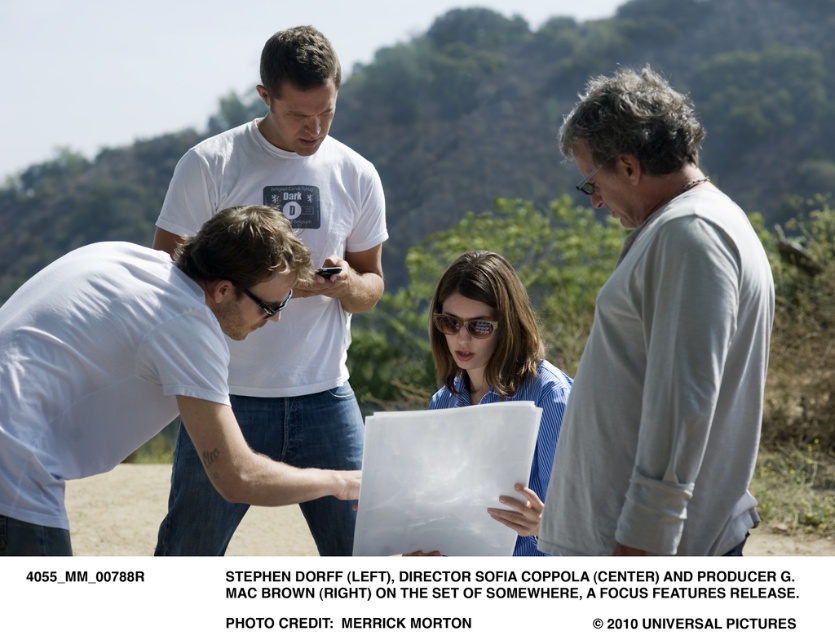
You are a photographer trying to capture a clear shot of the brown reflective sunglasses at center and the matte black goggles at center. Since both are at the center, which one is more to the right?

The brown reflective sunglasses at center is positioned on the right side of matte black goggles at center, so it is more to the right.

You are a photographer trying to capture a closeup of the brown reflective sunglasses at center and the matte black goggles at center. Given that your camera lens can only accommodate objects up to 10 cm in width, can you determine which of these items might not fit within the frame?

The brown reflective sunglasses at center has a greater width than the matte black goggles at center. Since the camera lens can only accommodate up to 10 cm, if the sunglasses exceed this width, they might not fit, but the goggles, being narrower, would likely fit. However, without exact measurements, it depends on the sunglasses actual size.

You are a photographer trying to capture a candid shot of the gray cotton shirt at center and the brown reflective sunglasses at center. Since you want to ensure both subjects are in focus, you need to know their relative heights. Which one is taller?

The gray cotton shirt at center is much taller than the brown reflective sunglasses at center, so you should focus on the gray cotton shirt at center first as it is taller.